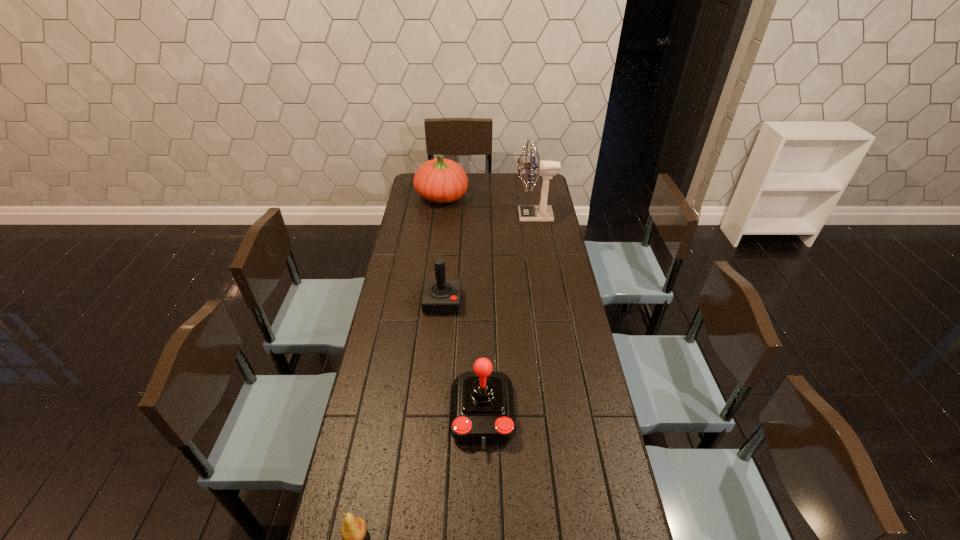
At what (x,y) coordinates should I click in order to perform the action: click on the rightmost object. Please return your answer as a coordinate pair (x, y). Image resolution: width=960 pixels, height=540 pixels. Looking at the image, I should click on (547, 169).

You are a GUI agent. You are given a task and a screenshot of the screen. Output one action in this format:
    pyautogui.click(x=<x>, y=<y>)
    Task: Click on the tallest object
    
    Given the screenshot: What is the action you would take?
    click(547, 169)

Where is `pumpkin`? This screenshot has width=960, height=540. pumpkin is located at coordinates (439, 180).

Find the location of a particular element. This screenshot has width=960, height=540. the second nearest object is located at coordinates (482, 413).

Where is `the third nearest object`? Image resolution: width=960 pixels, height=540 pixels. the third nearest object is located at coordinates (440, 296).

Find the location of a particular element. The image size is (960, 540). vacant space located on the front-facing side of the rightmost object is located at coordinates (457, 215).

Where is `vacant space located 0.230m on the front-facing side of the rightmost object`? vacant space located 0.230m on the front-facing side of the rightmost object is located at coordinates (468, 215).

Locate an element on the screen. free space located 0.350m on the front-facing side of the rightmost object is located at coordinates (442, 215).

This screenshot has height=540, width=960. Identify the location of vacant region located 0.070m on the right of the pumpkin. (482, 197).

Find the location of a particular element. The width and height of the screenshot is (960, 540). vacant area situated on the base of the nearer joystick is located at coordinates (484, 532).